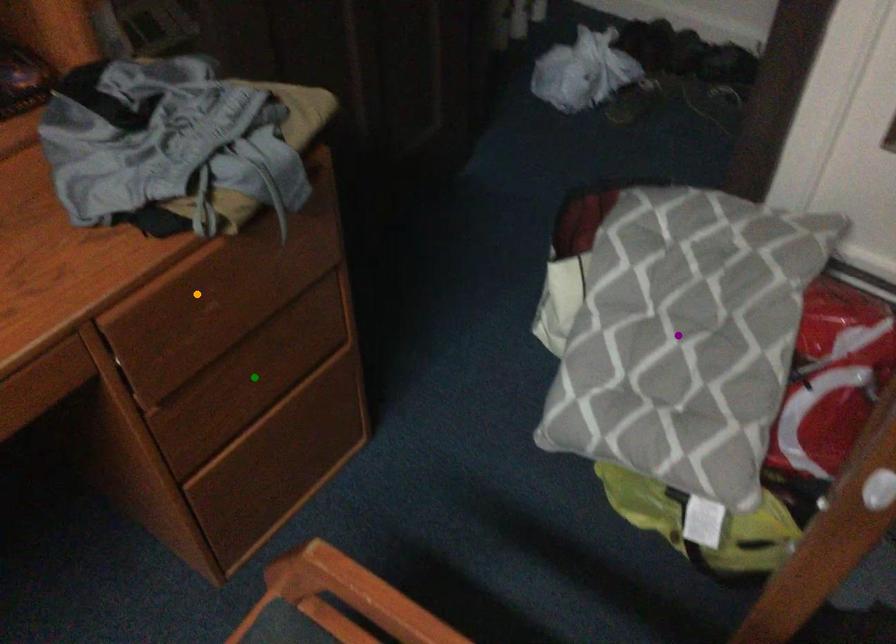
Order these from nearest to farthest:
green point | purple point | orange point

orange point → green point → purple point